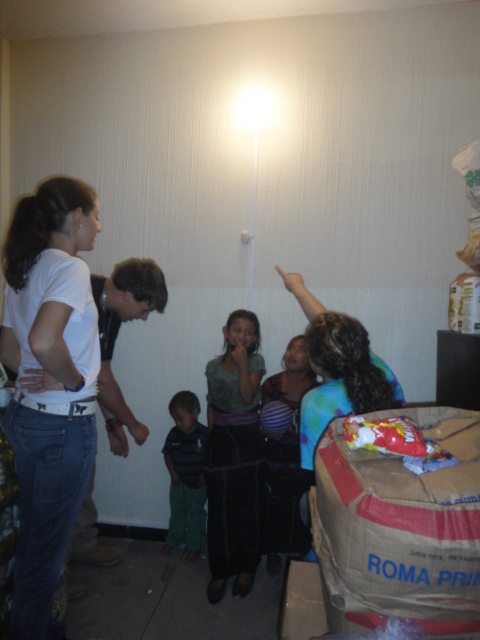
Question: Where is white matte shirt at left located in relation to striped polo shirt at center in the image?

Choices:
 (A) left
 (B) right

Answer: (A)

Question: Estimate the real-world distances between objects in this image. Which object is closer to the striped polo shirt at center?

Choices:
 (A) white matte shirt at left
 (B) white matte t-shirt at left

Answer: (A)

Question: Can you confirm if white matte t-shirt at left is positioned to the left of striped polo shirt at center?

Choices:
 (A) yes
 (B) no

Answer: (A)

Question: Which point appears farthest from the camera in this image?

Choices:
 (A) (147, 429)
 (B) (181, 401)

Answer: (B)

Question: Is white matte shirt at left closer to camera compared to striped polo shirt at center?

Choices:
 (A) yes
 (B) no

Answer: (A)

Question: Estimate the real-world distances between objects in this image. Which object is farther from the striped polo shirt at center?

Choices:
 (A) white matte shirt at left
 (B) white matte t-shirt at left

Answer: (B)